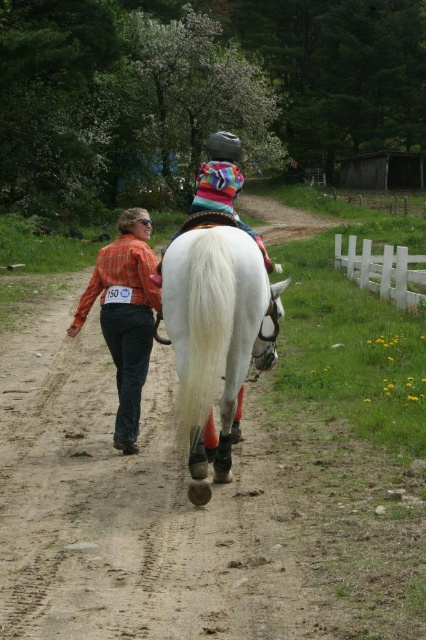
Can you confirm if white glossy horse at center is thinner than orange plaid shirt at center?

Correct, white glossy horse at center's width is less than orange plaid shirt at center's.

Is white glossy horse at center taller than orange plaid shirt at center?

Incorrect, white glossy horse at center's height is not larger of orange plaid shirt at center's.

Is point (166, 253) positioned before point (135, 330)?

Yes.

Find the location of a particular element. The image size is (426, 640). white glossy horse at center is located at coordinates (215, 333).